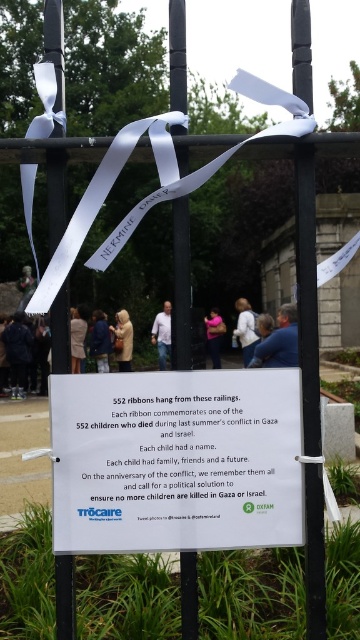
Question: Estimate the real-world distances between objects in this image. Which object is farther from the light brown hair at center?

Choices:
 (A) light brown coat at center
 (B) tan leather jacket at center

Answer: (A)

Question: Is white matte pole at upper center bigger than light brown hair at center?

Choices:
 (A) no
 (B) yes

Answer: (A)

Question: Which of these objects is positioned closest to the tan leather jacket at center?

Choices:
 (A) white ribbon at center
 (B) white matte pole at left
 (C) white matte ribbon at upper left
 (D) white matte pole at upper center

Answer: (C)

Question: Can you confirm if blue shirt at center is positioned to the left of light brown coat at center?

Choices:
 (A) no
 (B) yes

Answer: (A)

Question: Considering the relative positions of dark blue jacket at left and pink fabric at center in the image provided, where is dark blue jacket at left located with respect to pink fabric at center?

Choices:
 (A) below
 (B) above

Answer: (A)

Question: Which object is the closest to the dark blue jacket at left?

Choices:
 (A) white matte pole at left
 (B) tan leather jacket at center

Answer: (B)